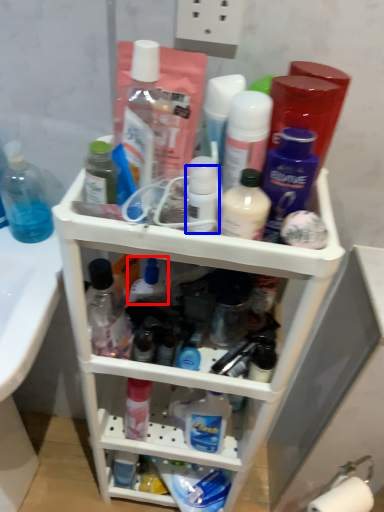
Question: Which object appears closest to the camera in this image, toiletry (highlighted by a red box) or toiletry (highlighted by a blue box)?

Choices:
 (A) toiletry
 (B) toiletry

Answer: (B)